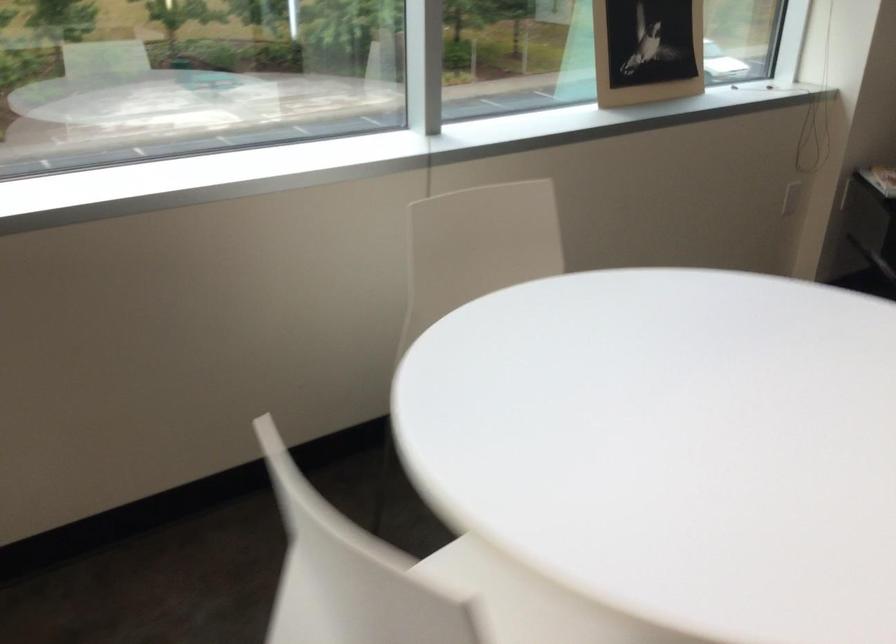
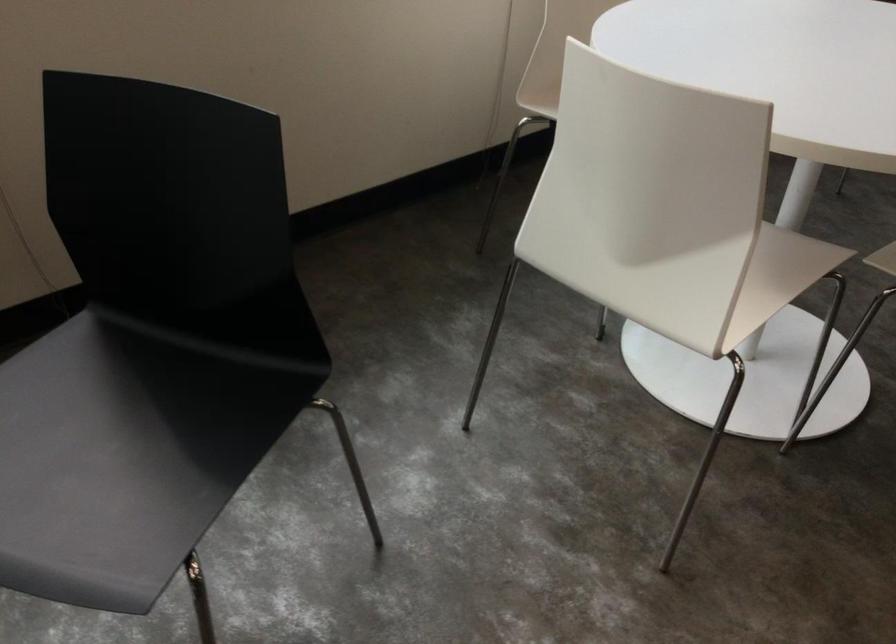
Question: The images are taken continuously from a first-person perspective. In which direction is your viewpoint rotating?

Choices:
 (A) Left
 (B) Right
 (C) Up
 (D) Down

Answer: (D)